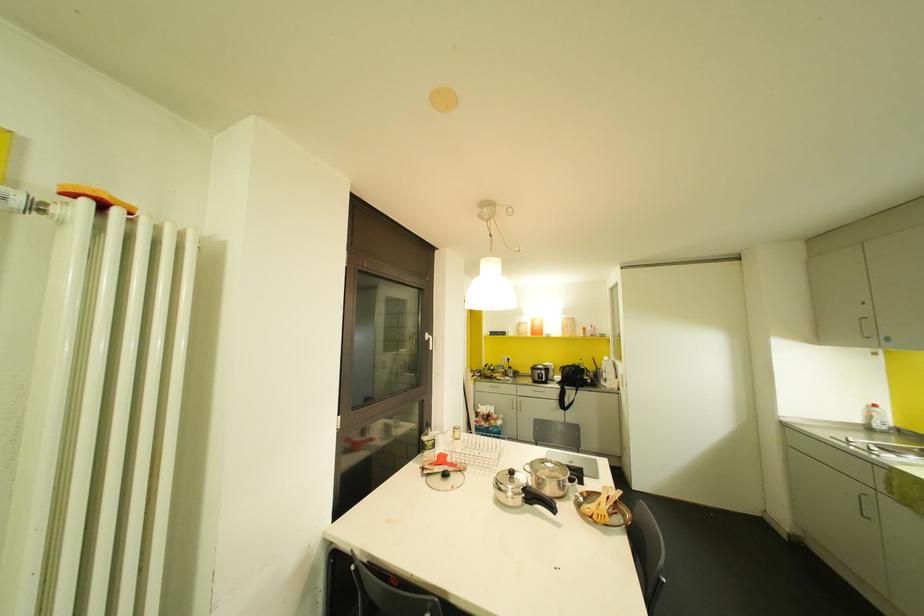
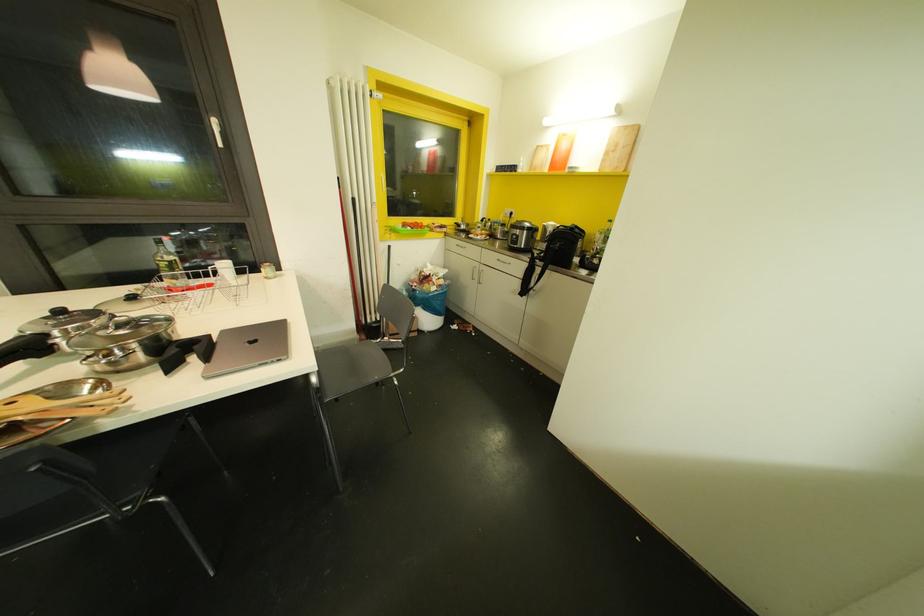
In the second image, find the point that corresponds to point (430, 347) in the first image.

(220, 145)